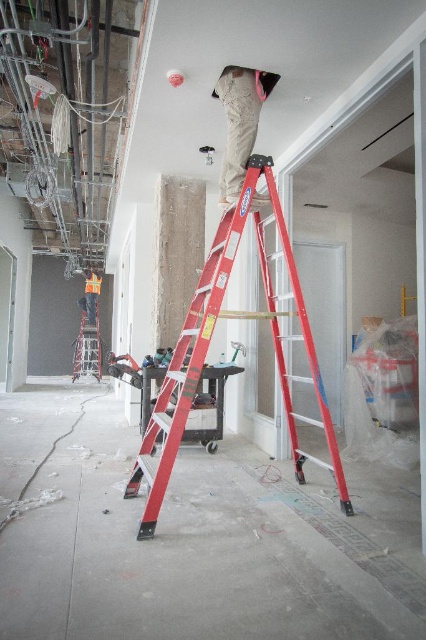
You are an inspector checking safety gear at a construction site. You observe two workers at the center of the scene. One is wearing khaki cotton pants at center and the other has reflective orange vest at center. Which worker is wearing the smaller item?

The khaki cotton pants at center has a smaller size compared to the reflective orange vest at center, so the worker wearing the khaki cotton pants at center is wearing the smaller item.

You are a safety inspector checking the construction site. You notice the red metallic ladder at center and the reflective orange vest at center. Which object is taller?

The red metallic ladder at center is taller than the reflective orange vest at center.

You are a safety inspector at the construction site shown in the image. You need to ensure all ladders are placed at least 1 meter away from the electrical wires visible in the scene. Given the ladder is at coordinates point 0.539, 0.491, can you confirm if the red metallic ladder at center is positioned safely away from the electrical wires?

The red metallic ladder at center is positioned at coordinates point (209, 344). Since the question does not provide specific coordinates or distance measurements between the ladder and the electrical wires, it is impossible to confirm if the red metallic ladder at center meets the safety requirement of being at least 1 meter away from the electrical wires.